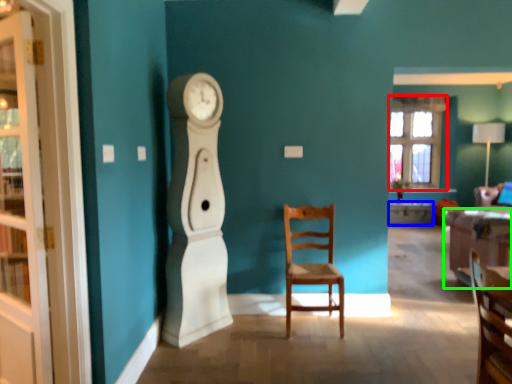
Question: Based on their relative distances, which object is farther from window (highlighted by a red box)? Choose from desk (highlighted by a blue box) and studio couch (highlighted by a green box).

Choices:
 (A) desk
 (B) studio couch

Answer: (B)